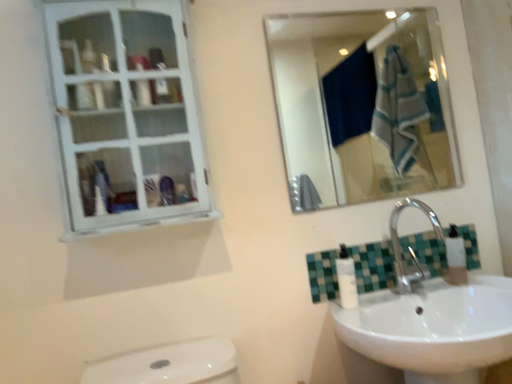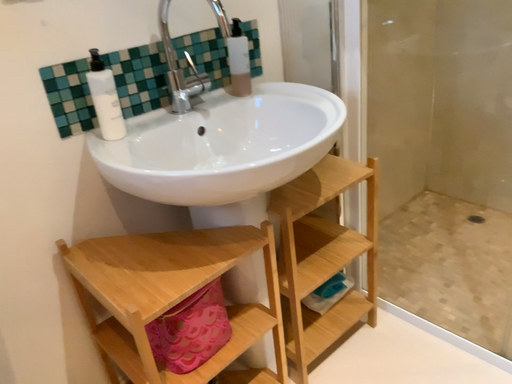
Question: How did the camera likely rotate when shooting the video?

Choices:
 (A) rotated downward
 (B) rotated upward

Answer: (A)